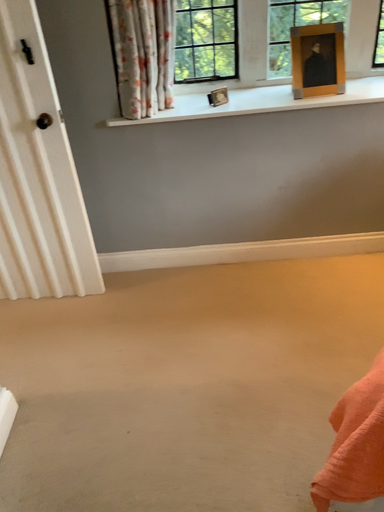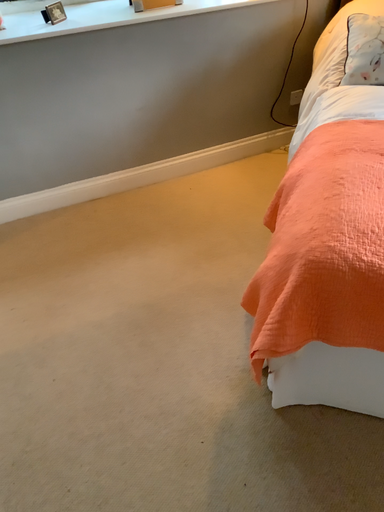
Question: Which way did the camera rotate in the video?

Choices:
 (A) rotated right
 (B) rotated left

Answer: (A)